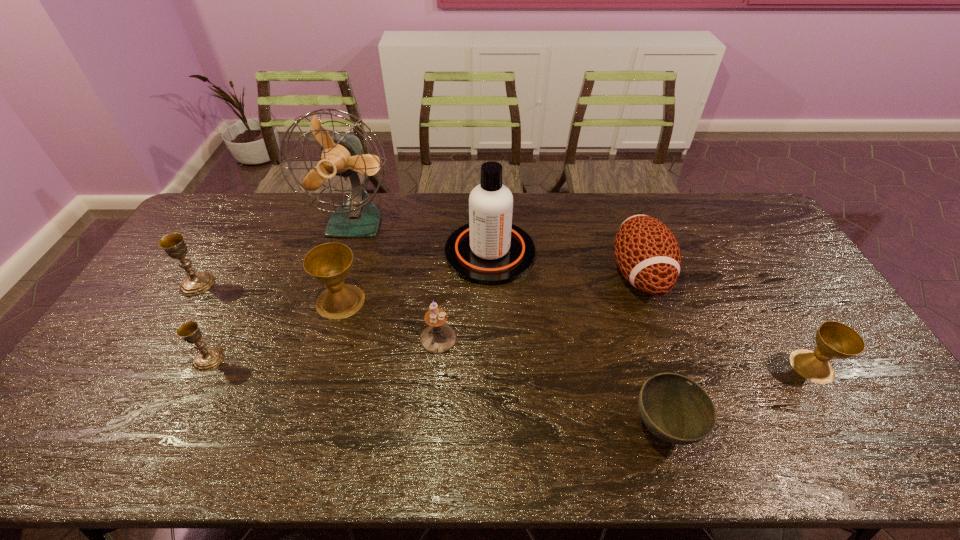
The height and width of the screenshot is (540, 960). I want to click on vacant area situated 0.300m on the back of the bigger brown chalice, so click(x=363, y=224).

Find the location of a particular element. vacant area situated on the back of the purple candle holder is located at coordinates (444, 258).

What are the coordinates of `free space located on the right of the nearer gold chalice` in the screenshot? It's located at (346, 359).

Identify the location of vacant space located on the back of the rightmost object. (784, 321).

Identify the location of free region located on the right of the brown bowl. The height and width of the screenshot is (540, 960). (772, 427).

Identify the location of fan present at the far edge. (342, 155).

Find the location of a particular element. cleansing agent located at the far edge is located at coordinates (489, 250).

Locate an element on the screen. The width and height of the screenshot is (960, 540). object that is positioned at the near edge is located at coordinates (676, 409).

Where is `object that is at the left edge`? The image size is (960, 540). object that is at the left edge is located at coordinates (173, 244).

This screenshot has width=960, height=540. What are the coordinates of `object present at the right edge` in the screenshot? It's located at (836, 340).